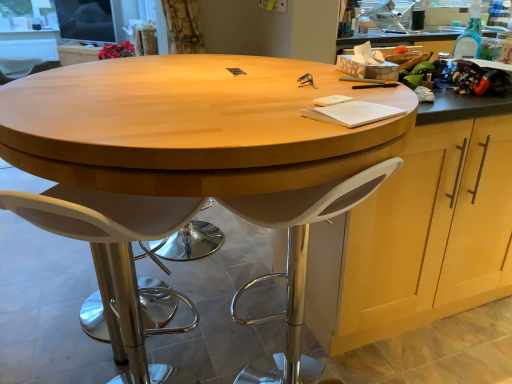
Question: From the image's perspective, is white plastic chair at left, which is the 1th chair in top-to-bottom order, beneath white plastic stool at center?

Choices:
 (A) yes
 (B) no

Answer: (B)

Question: Is white plastic chair at left, positioned as the 1th chair in back-to-front order, positioned beyond the bounds of white plastic stool at center?

Choices:
 (A) yes
 (B) no

Answer: (A)

Question: Is the depth of white plastic chair at left, positioned as the second chair in right-to-left order, less than that of white plastic stool at center?

Choices:
 (A) yes
 (B) no

Answer: (B)

Question: Does white plastic chair at left, marked as the 1th chair in a left-to-right arrangement, have a lesser height compared to white plastic stool at center?

Choices:
 (A) no
 (B) yes

Answer: (B)

Question: From a real-world perspective, is white plastic chair at left, which is the 1th chair in top-to-bottom order, positioned under white plastic stool at center based on gravity?

Choices:
 (A) no
 (B) yes

Answer: (B)

Question: Is curtaintextured fabric at upper left in front of or behind white plastic stool at lower left, acting as the 2th chair starting from the top, in the image?

Choices:
 (A) behind
 (B) front

Answer: (A)

Question: Visually, is curtaintextured fabric at upper left positioned to the left or to the right of white plastic stool at lower left, placed as the 1th chair when sorted from right to left?

Choices:
 (A) right
 (B) left

Answer: (B)

Question: In terms of size, does curtaintextured fabric at upper left appear bigger or smaller than white plastic stool at lower left, which is counted as the 2th chair, starting from the back?

Choices:
 (A) small
 (B) big

Answer: (A)

Question: Is curtaintextured fabric at upper left taller or shorter than white plastic stool at lower left, which is the 1th chair in front-to-back order?

Choices:
 (A) short
 (B) tall

Answer: (A)

Question: Is white plastic chair at left, positioned as the second chair in right-to-left order, situated inside wooden cabinet at right, which is the first cabinetry from right to left, or outside?

Choices:
 (A) outside
 (B) inside

Answer: (A)

Question: In terms of width, does white plastic chair at left, positioned as the second chair in right-to-left order, look wider or thinner when compared to wooden cabinet at right, which is the 2th cabinetry from left to right?

Choices:
 (A) thin
 (B) wide

Answer: (A)

Question: Based on their sizes in the image, would you say white plastic chair at left, the second chair ordered from the bottom, is bigger or smaller than wooden cabinet at right, which is the 1th cabinetry from bottom to top?

Choices:
 (A) big
 (B) small

Answer: (B)

Question: In the image, is white plastic chair at left, positioned as the 1th chair in back-to-front order, on the left side or the right side of wooden cabinet at right, which is the 2th cabinetry from left to right?

Choices:
 (A) left
 (B) right

Answer: (A)

Question: From the image's perspective, is white plastic stool at center located above or below white plastic chair at left, positioned as the second chair in right-to-left order?

Choices:
 (A) above
 (B) below

Answer: (B)

Question: Considering the relative positions of white plastic stool at center and white plastic chair at left, positioned as the second chair in right-to-left order, in the image provided, is white plastic stool at center to the left or to the right of white plastic chair at left, positioned as the second chair in right-to-left order,?

Choices:
 (A) right
 (B) left

Answer: (A)